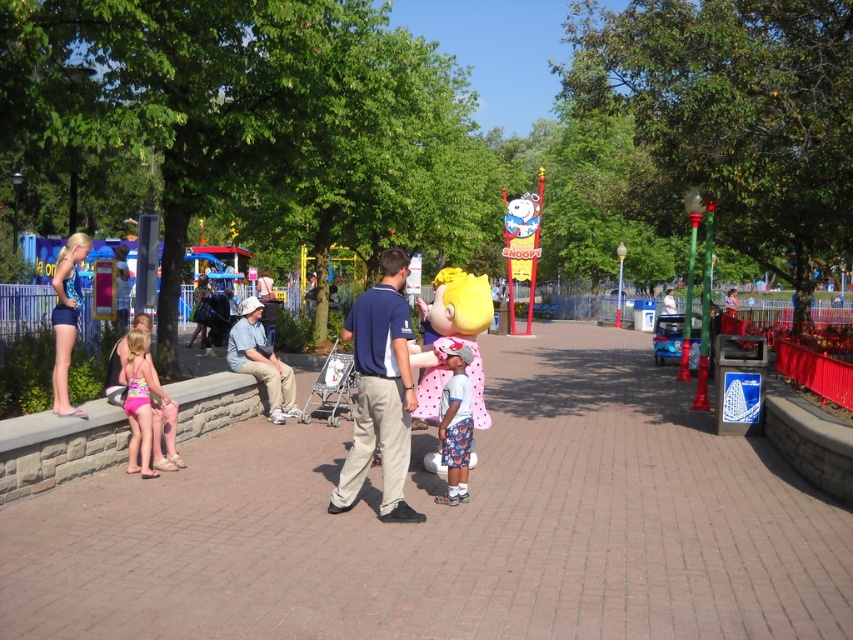
Question: Can you confirm if matte blue shirt at center is wider than pink polka dot dress at center?

Choices:
 (A) no
 (B) yes

Answer: (B)

Question: Considering the real-world distances, which object is closest to the matte blue shirt at center?

Choices:
 (A) pink fabric swimsuit at left
 (B) pink polka dot dress at center
 (C) light blue cotton shirt at center

Answer: (B)

Question: Does pink polka dot dress at center have a smaller size compared to light blue cotton shirt at center?

Choices:
 (A) yes
 (B) no

Answer: (A)

Question: Is pink polka dot dress at center positioned at the back of light blue cotton shirt at center?

Choices:
 (A) yes
 (B) no

Answer: (B)

Question: Which of the following is the closest to the observer?

Choices:
 (A) (289, 369)
 (B) (456, 365)

Answer: (B)

Question: Which object is farther from the camera taking this photo?

Choices:
 (A) matte blue shirt at center
 (B) pink polka dot dress at center

Answer: (B)